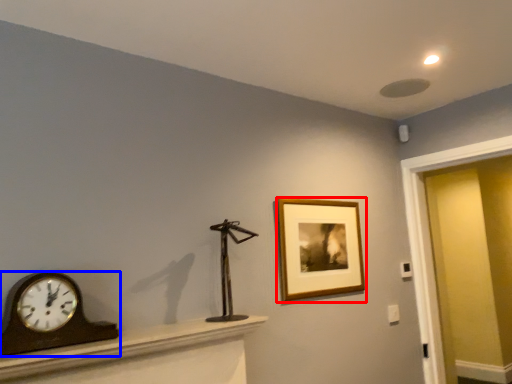
Question: Which of the following is the closest to the observer, picture frame (highlighted by a red box) or wall clock (highlighted by a blue box)?

Choices:
 (A) picture frame
 (B) wall clock

Answer: (B)